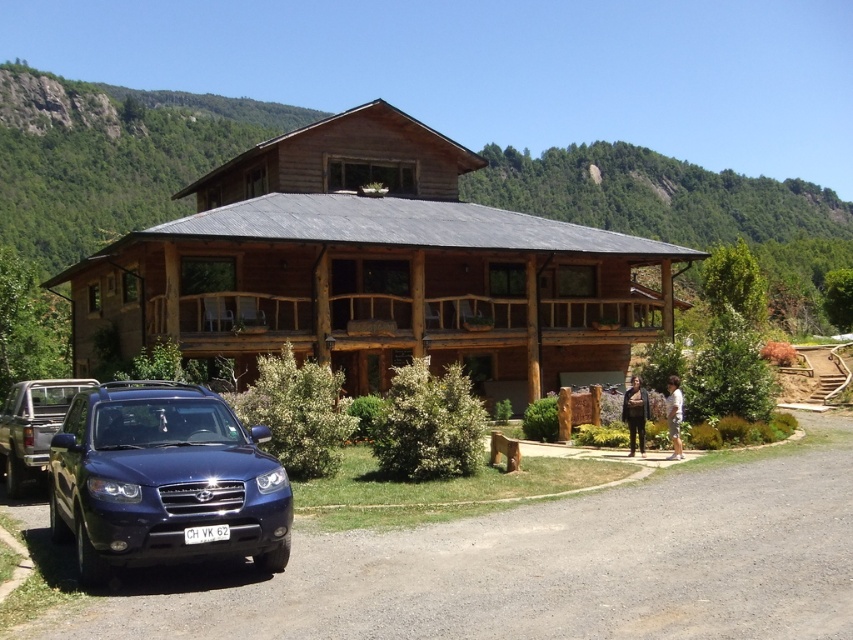
Question: Which object is farther from the camera taking this photo?

Choices:
 (A) satin blue suv at lower left
 (B) matte blue suv at lower left
 (C) smooth asphalt driveway at lower left

Answer: (B)

Question: Which object is the closest to the brown wooden porch at center?

Choices:
 (A) smooth asphalt driveway at lower left
 (B) satin blue suv at lower left
 (C) matte blue suv at lower left
 (D) brown wooden cabin at center

Answer: (D)

Question: Is smooth asphalt driveway at lower left bigger than brown wooden porch at center?

Choices:
 (A) yes
 (B) no

Answer: (B)

Question: Based on their relative distances, which object is nearer to the brown wooden cabin at center?

Choices:
 (A) satin blue suv at lower left
 (B) smooth asphalt driveway at lower left
 (C) brown wooden porch at center
 (D) matte blue suv at lower left

Answer: (C)

Question: Is brown wooden cabin at center above brown wooden porch at center?

Choices:
 (A) no
 (B) yes

Answer: (B)

Question: Is the position of brown wooden cabin at center more distant than that of matte blue suv at lower left?

Choices:
 (A) yes
 (B) no

Answer: (A)